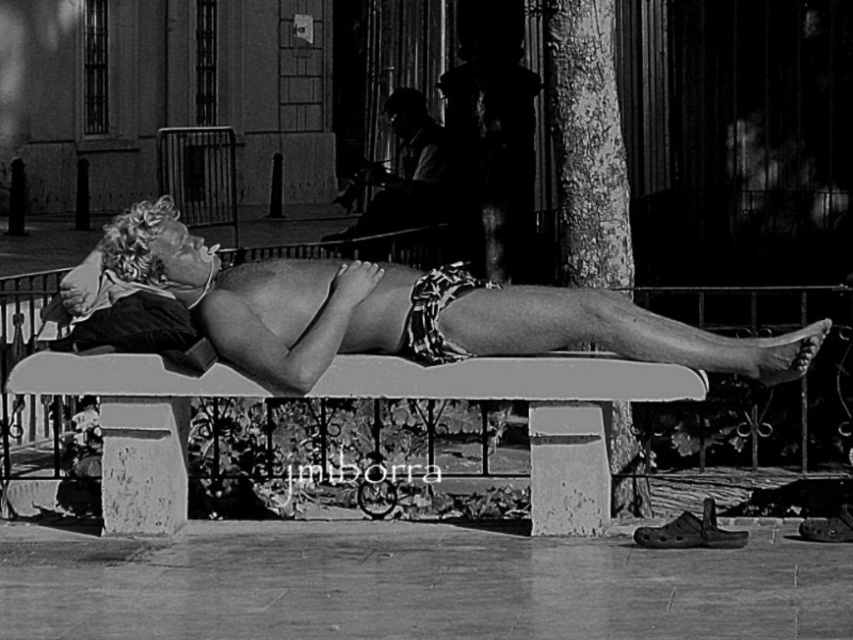
You are a photographer trying to capture the smooth leather jacket at upper center and the printed fabric shorts at center. Which item is located to the left of the other?

The smooth leather jacket at upper center is positioned on the left side of printed fabric shorts at center.